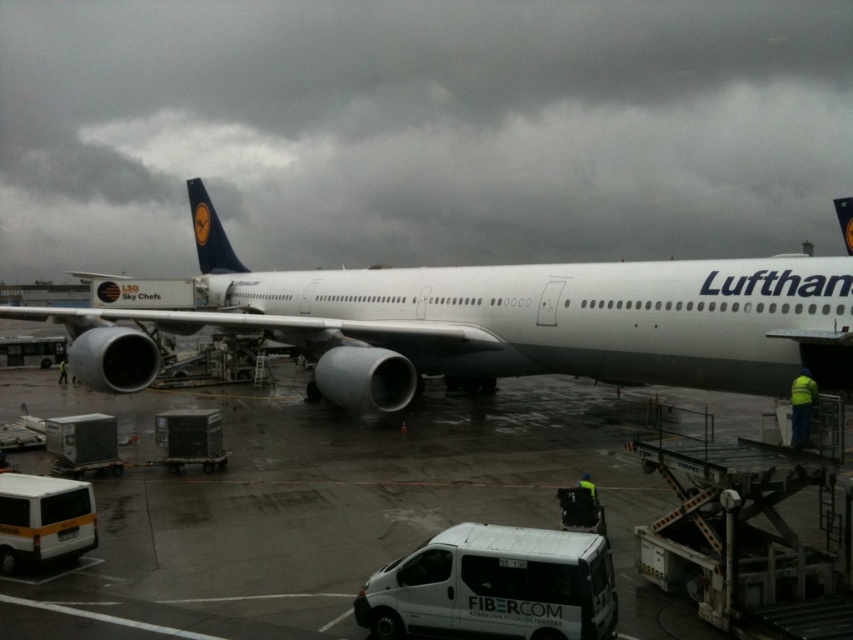
You are a delivery driver who needs to park your white matte van at lower center without blocking the white metallic airplane at center. Is this possible given their current positions?

The white metallic airplane at center is located above the white matte van at lower center, so the van is already positioned below the airplane. Since the airplane is above, the van cannot block it from its current position. Therefore, it is possible to park the white matte van at lower center without blocking the white metallic airplane at center.

You are an airport worker who needs to park the white matte van at lower left next to the white metallic airplane at center. Given that the parking space is only wide enough for the van, will the airplane fit in the same space?

The white metallic airplane at center is wider than the white matte van at lower left, so it will not fit in the parking space designated for the van.

You are a ground crew member at the airport. You need to move a piece of equipment from the white matte van at lower center to the white metallic airplane at center. In which direction should you move the equipment?

You should move the equipment to the left, as the white metallic airplane at center is located to the left of the white matte van at lower center.